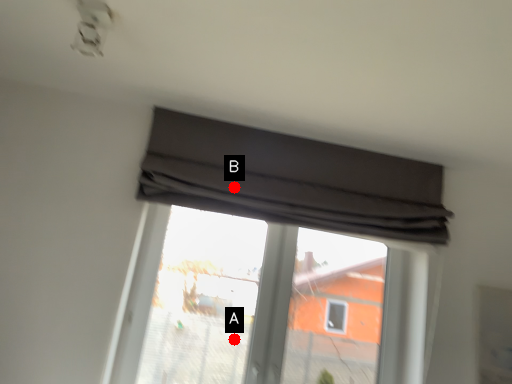
Question: Two points are circled on the image, labeled by A and B beside each circle. Among these points, which one is farthest from the camera?

Choices:
 (A) A is further
 (B) B is further

Answer: (A)